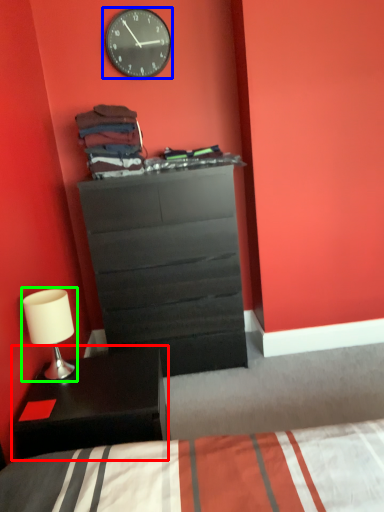
Question: Considering the real-world distances, which object is farthest from nightstand (highlighted by a red box)? wall clock (highlighted by a blue box) or table lamp (highlighted by a green box)?

Choices:
 (A) wall clock
 (B) table lamp

Answer: (A)